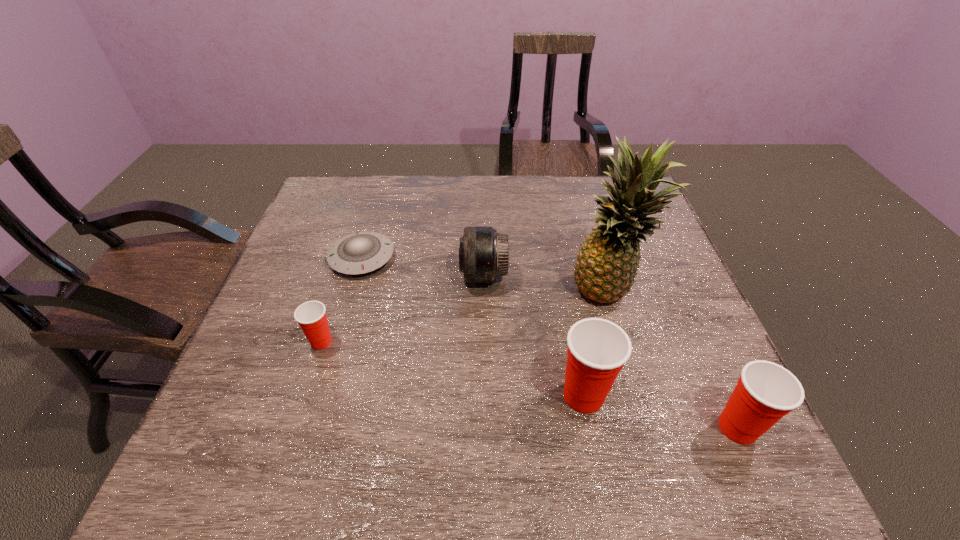
Image resolution: width=960 pixels, height=540 pixels. Identify the location of free space located on the back of the rightmost object. (683, 304).

Find the location of `vacant region located 0.250m on the front of the pineapple`. vacant region located 0.250m on the front of the pineapple is located at coordinates (643, 414).

I want to click on vacant region located 0.400m on the right of the shortest object, so click(x=543, y=258).

Where is `vacant region located 0.190m on the front-facing side of the fourth object from right to left`? vacant region located 0.190m on the front-facing side of the fourth object from right to left is located at coordinates (387, 275).

Where is `free region located on the front-facing side of the fourth object from right to left`? free region located on the front-facing side of the fourth object from right to left is located at coordinates (418, 275).

Identify the location of vacant space located on the front-facing side of the fourth object from right to left. (437, 275).

I want to click on Dixie cup that is at the left edge, so click(311, 316).

The image size is (960, 540). In order to click on saucer at the left edge in this screenshot , I will do `click(361, 252)`.

This screenshot has width=960, height=540. I want to click on Dixie cup positioned at the right edge, so click(x=765, y=392).

Image resolution: width=960 pixels, height=540 pixels. I want to click on pineapple that is at the right edge, so click(607, 263).